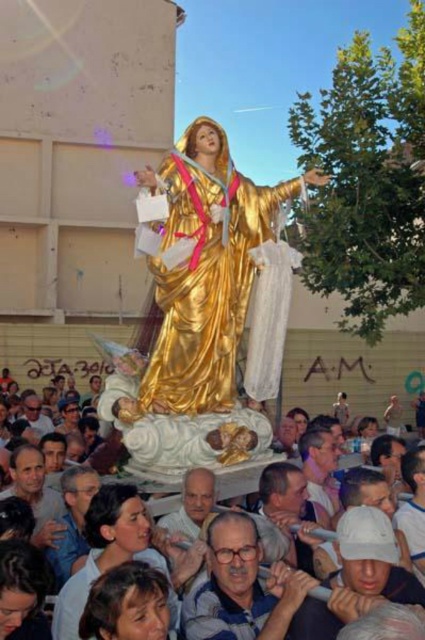
You are a photographer at the religious procession. You want to capture a photo that includes both the gold polished statue at center and the smooth skin face at lower left. Since you want to ensure both are in focus, you need to know which one is taller. Can you tell me which is taller?

The gold polished statue at center is taller than the smooth skin face at lower left.